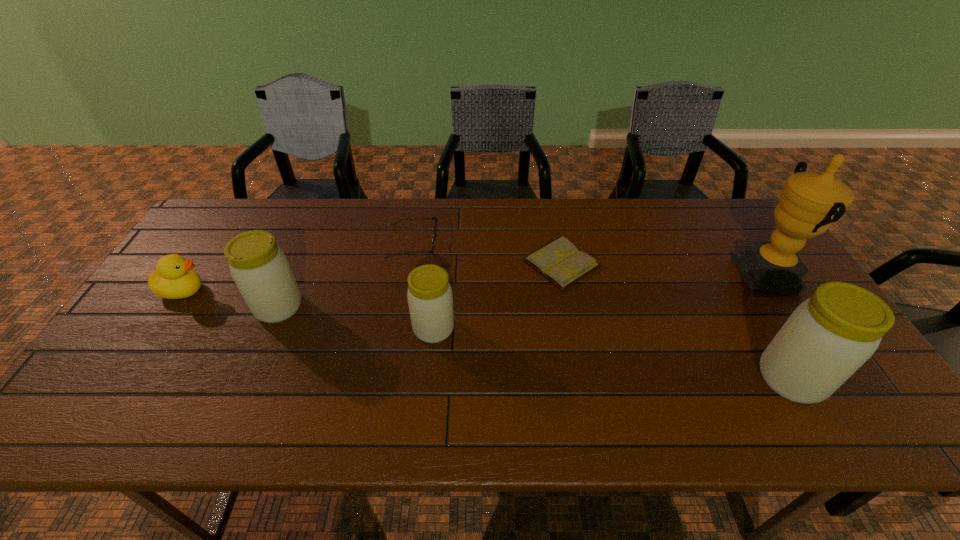
Where is `the third shortest object`? This screenshot has width=960, height=540. the third shortest object is located at coordinates (174, 278).

The image size is (960, 540). What are the coordinates of `duck` in the screenshot? It's located at [x=174, y=278].

Locate an element on the screen. The width and height of the screenshot is (960, 540). vacant space located 0.180m on the right of the fifth shortest object is located at coordinates tap(369, 307).

This screenshot has height=540, width=960. Find the location of `vacant space located on the right of the shortest jar`. vacant space located on the right of the shortest jar is located at coordinates (509, 329).

The image size is (960, 540). In order to click on vacant area situated 0.130m on the back of the nearest object in this screenshot , I will do `click(753, 312)`.

Identify the location of free location located on the front-facing side of the spectacles. (512, 242).

I want to click on free space located 0.210m at the front of the award with handles, so click(669, 274).

This screenshot has width=960, height=540. Find the location of `free space located at the front of the award with handles`. free space located at the front of the award with handles is located at coordinates (707, 274).

Locate an element on the screen. Image resolution: width=960 pixels, height=540 pixels. vacant space located 0.100m at the front of the award with handles is located at coordinates (707, 274).

This screenshot has height=540, width=960. I want to click on vacant space situated 0.140m on the back of the diary, so click(551, 212).